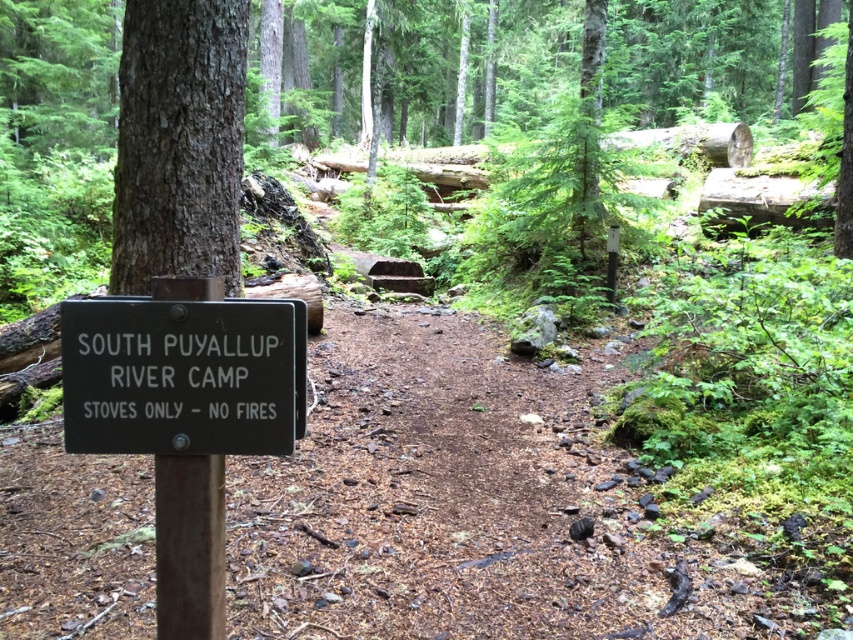
Question: Considering the relative positions of black wood sign at left and smooth brown tree trunk at upper left in the image provided, where is black wood sign at left located with respect to smooth brown tree trunk at upper left?

Choices:
 (A) right
 (B) left

Answer: (A)

Question: Among these objects, which one is nearest to the camera?

Choices:
 (A) smooth brown tree trunk at upper left
 (B) black wood sign at left

Answer: (B)

Question: Is black wood sign at left to the left of smooth brown tree trunk at upper left from the viewer's perspective?

Choices:
 (A) no
 (B) yes

Answer: (A)

Question: Is black wood sign at left closer to the viewer compared to smooth brown tree trunk at upper left?

Choices:
 (A) yes
 (B) no

Answer: (A)

Question: Which object is closer to the camera taking this photo?

Choices:
 (A) black wood sign at left
 (B) smooth brown tree trunk at upper left

Answer: (A)